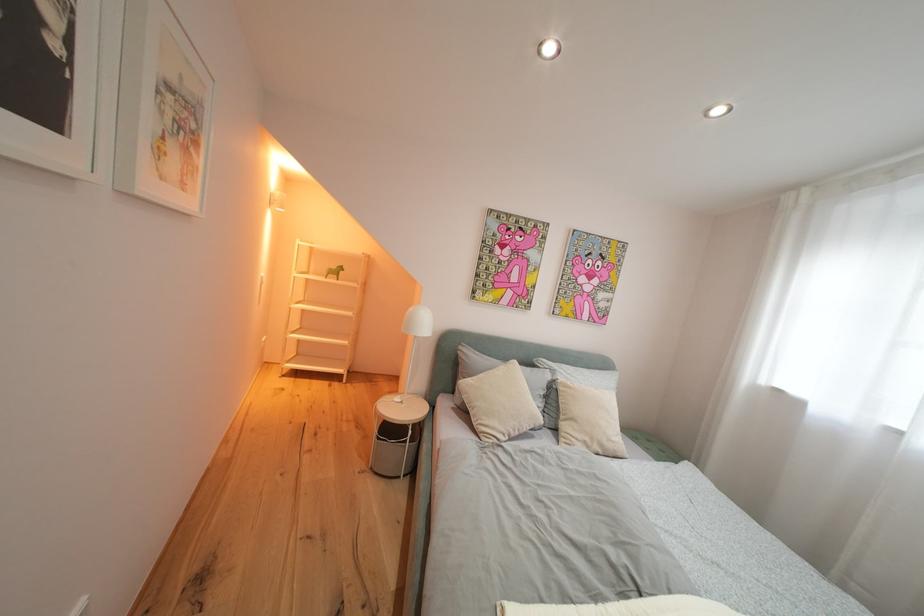
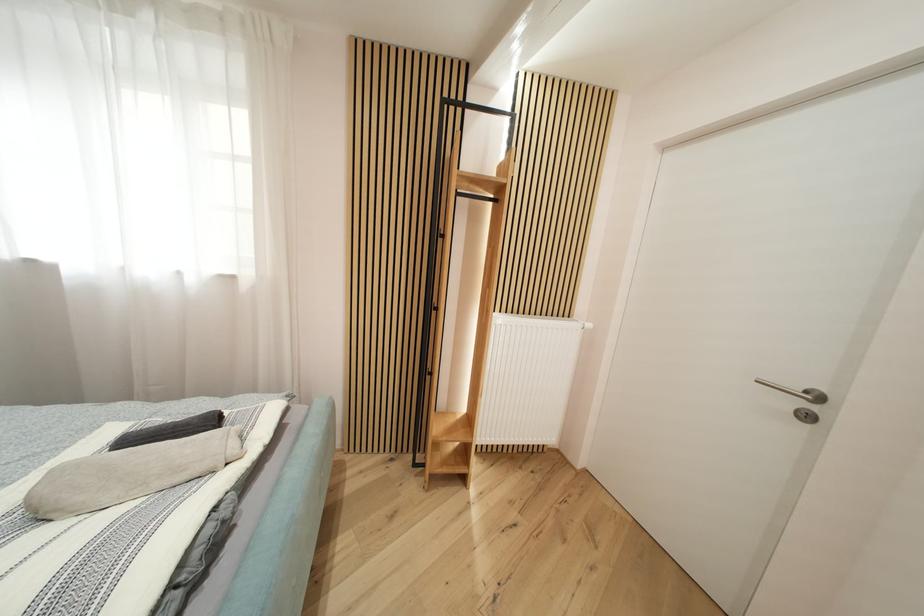
How did the camera likely rotate?

The rotation direction of the camera is right-down.